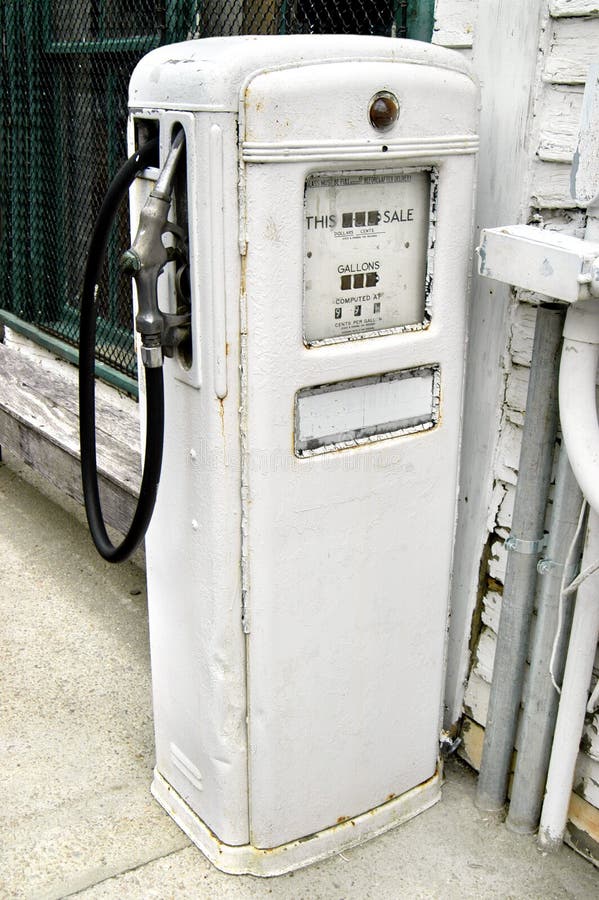
Where is `white painted pipe`? white painted pipe is located at coordinates (571, 722).